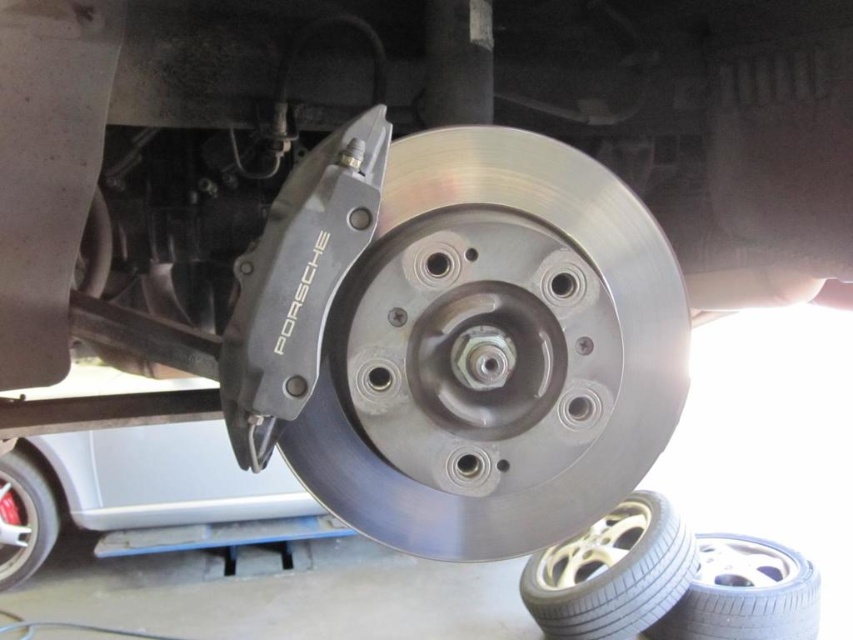
Which is behind, point (793, 632) or point (49, 515)?

The point (49, 515) is more distant.

What do you see at coordinates (744, 593) in the screenshot? Image resolution: width=853 pixels, height=640 pixels. I see `black rubber tire at lower right` at bounding box center [744, 593].

Who is more distant from viewer, (762, 568) or (4, 532)?

The point (4, 532) is more distant.

Where is `black rubber tire at lower right`? This screenshot has height=640, width=853. black rubber tire at lower right is located at coordinates [744, 593].

Which is above, white rubber tire at lower right or brushed metal tire at lower left?

brushed metal tire at lower left is higher up.

Is white rubber tire at lower right positioned in front of brushed metal tire at lower left?

That is True.

The height and width of the screenshot is (640, 853). What are the coordinates of `white rubber tire at lower right` in the screenshot? It's located at (612, 572).

Who is higher up, white rubber tire at lower right or black rubber tire at lower right?

white rubber tire at lower right is higher up.

Measure the distance from white rubber tire at lower right to black rubber tire at lower right.

white rubber tire at lower right and black rubber tire at lower right are 9.02 inches apart from each other.

At what (x,y) coordinates should I click in order to perform the action: click on white rubber tire at lower right. Please return your answer as a coordinate pair (x, y). The height and width of the screenshot is (640, 853). Looking at the image, I should click on (612, 572).